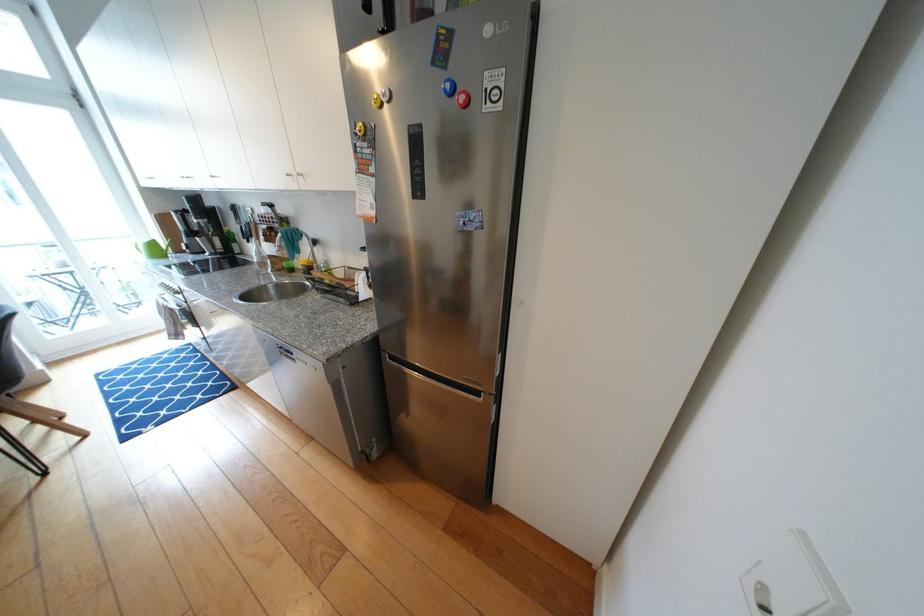
Where is `knife handle`? Image resolution: width=924 pixels, height=616 pixels. knife handle is located at coordinates (249, 232).